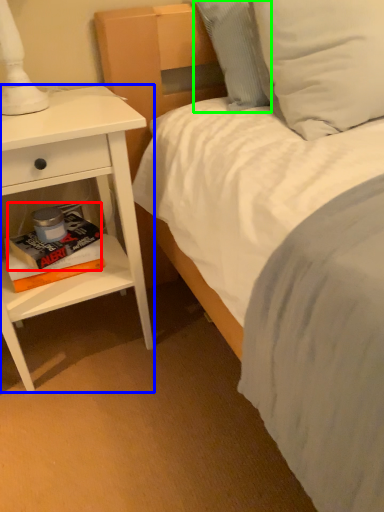
Question: Which object is positioned farthest from paperback book (highlighted by a red box)? Select from nightstand (highlighted by a blue box) and pillow (highlighted by a green box).

Choices:
 (A) nightstand
 (B) pillow

Answer: (B)